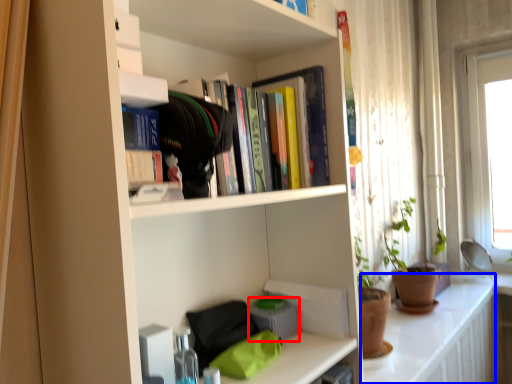
Question: Which object appears closest to the camera in this image, basket (highlighted by a red box) or counter top (highlighted by a blue box)?

Choices:
 (A) basket
 (B) counter top

Answer: (A)